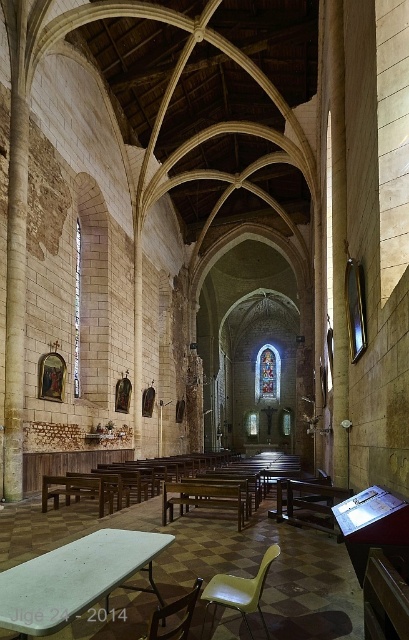
You are attending a ceremony in this historic church and need to sit on one of the chairs. Which chair, the light green plastic chair at lower center or the matte beige chair at lower center, will allow you to see over the pew in front of you better?

The light green plastic chair at lower center is taller than the matte beige chair at lower center, so you can see over the pew better from there.

You are standing inside the historic church and want to reach the point marked at coordinates (x=253, y=596). Given that the church is 100 feet long, can you estimate how far you need to walk to reach that point from your current position?

The point at coordinates (x=253, y=596) is 66.40 feet away from the viewer, so you would need to walk approximately 66.40 feet to reach it.

You are standing at the entrance of the historic church and see the point marked at coordinates (x=74, y=579). What object is located at that point?

The point at coordinates (x=74, y=579) represents the white plastic table at center.